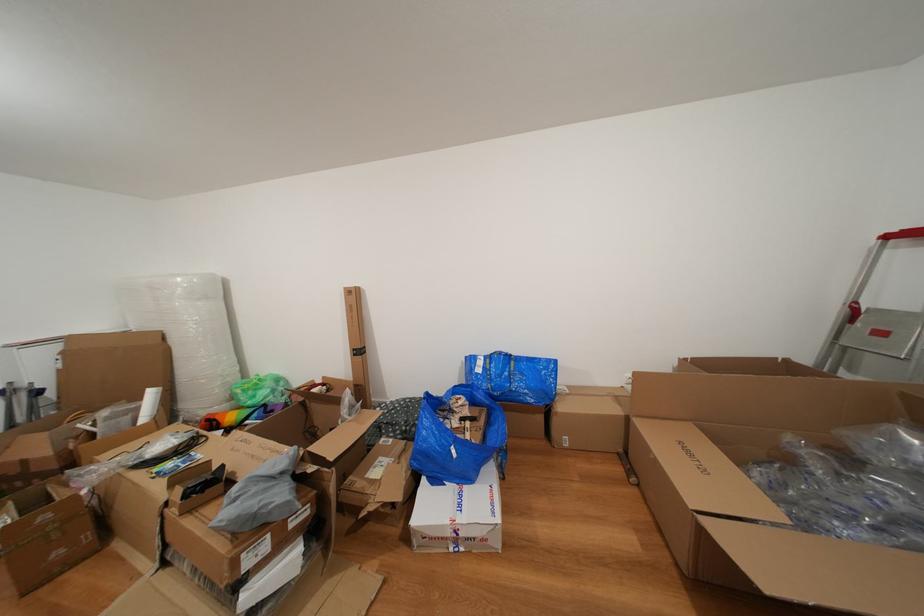
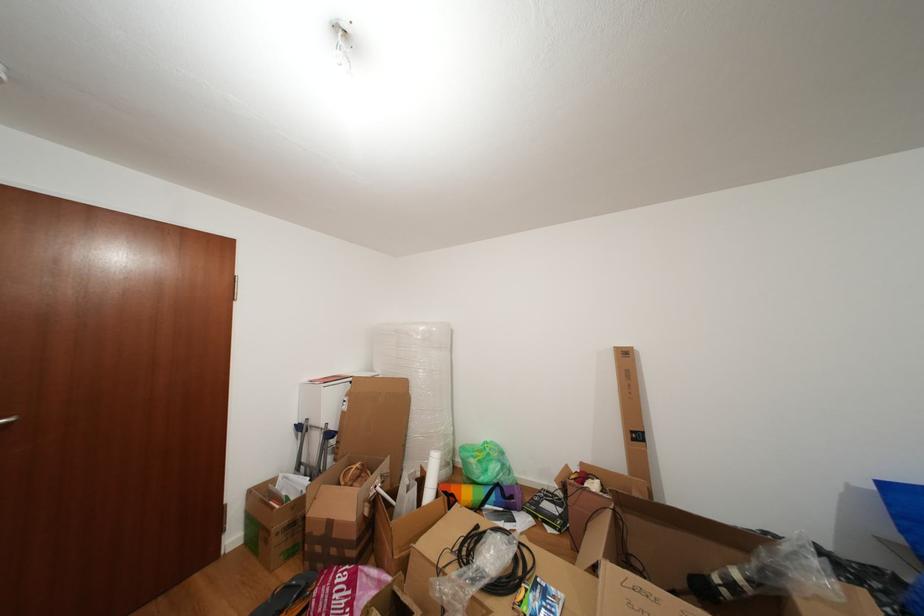
Locate, in the second image, the point that corresponds to (262,402) in the first image.

(494, 476)